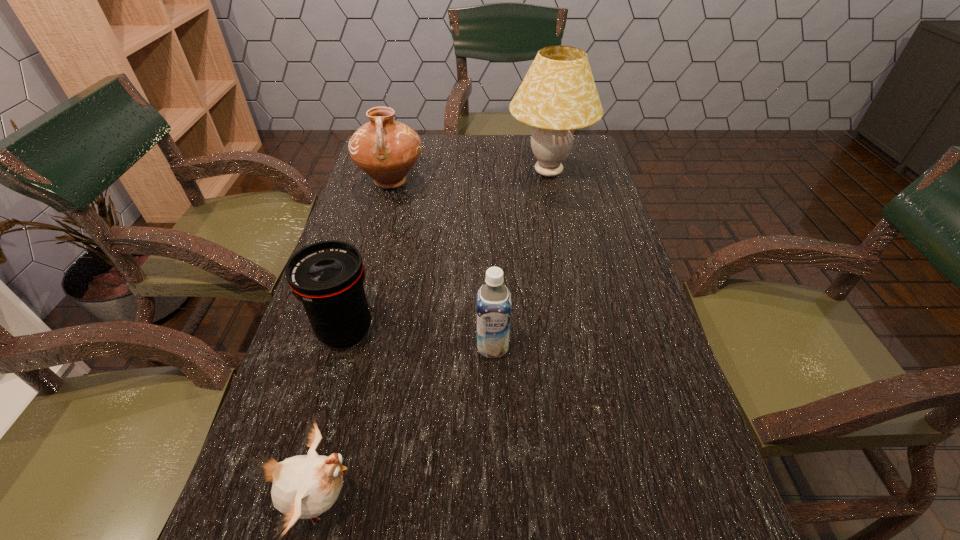
Locate an element on the screen. This screenshot has height=540, width=960. lampshade is located at coordinates (558, 94).

You are a GUI agent. You are given a task and a screenshot of the screen. Output one action in this format:
    pyautogui.click(x=<x>, y=<y>)
    Task: Click on the rightmost object
    The height and width of the screenshot is (540, 960).
    Given the screenshot: What is the action you would take?
    pyautogui.click(x=558, y=94)

Where is `pottery`? This screenshot has height=540, width=960. pottery is located at coordinates (386, 150).

Find the location of a particular element. This screenshot has width=960, height=540. the second object from right to left is located at coordinates (493, 298).

Image resolution: width=960 pixels, height=540 pixels. Identify the location of telephoto lens. tap(327, 277).

Locate an element on the screen. This screenshot has height=540, width=960. vacant area situated 0.090m on the front of the tallest object is located at coordinates (557, 214).

Image resolution: width=960 pixels, height=540 pixels. Identify the location of vacant space located 0.150m on the side of the pottery with the handle. (377, 232).

Identify the location of free space located on the label of the fourth object from left to right. (494, 414).

Find the location of `free space located on the back of the telephoto lens`. free space located on the back of the telephoto lens is located at coordinates pyautogui.click(x=364, y=262).

Where is `lampshade present at the far edge`? lampshade present at the far edge is located at coordinates point(558,94).